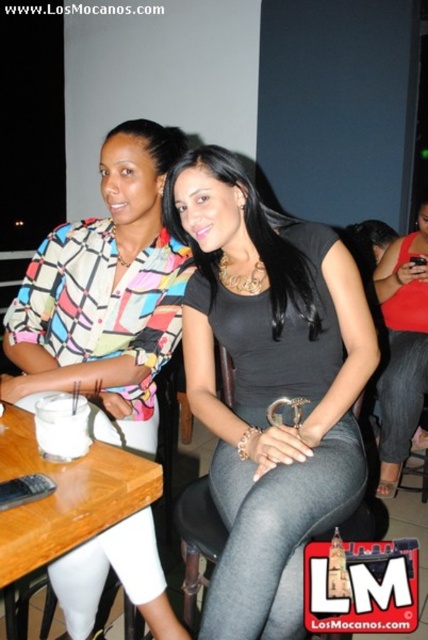
Question: Which point appears farthest from the camera in this image?

Choices:
 (A) (139, 524)
 (B) (398, 344)
 (C) (65, 412)

Answer: (B)

Question: Can you confirm if matte black dress at center is positioned to the right of wooden table at lower left?

Choices:
 (A) no
 (B) yes

Answer: (B)

Question: Does matte black dress at center appear on the left side of white matte cup at center?

Choices:
 (A) yes
 (B) no

Answer: (A)

Question: Among these points, which one is farthest from the camera?

Choices:
 (A) (80, 426)
 (B) (341, 368)
 (C) (416, 266)

Answer: (C)

Question: Based on their relative distances, which object is farther from the white matte cup at center?

Choices:
 (A) black matte dress at center
 (B) matte black dress at center
 (C) multicolored fabric shirt at upper left
 (D) white frosted glass at table left

Answer: (D)

Question: Does multicolored fabric shirt at upper left appear over wooden table at lower left?

Choices:
 (A) no
 (B) yes

Answer: (B)